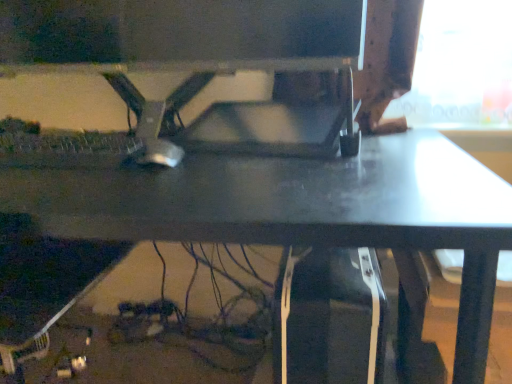
Identify the location of vacant area that is in front of silver metallic mouse at center. (137, 188).